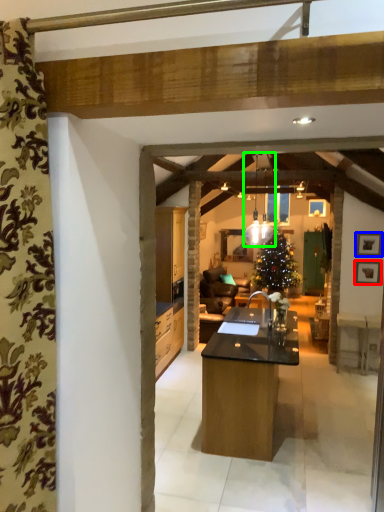
Question: Which object is the closest to the picture frame (highlighted by a red box)? Choose among these: picture frame (highlighted by a blue box) or light fixture (highlighted by a green box).

Choices:
 (A) picture frame
 (B) light fixture

Answer: (A)